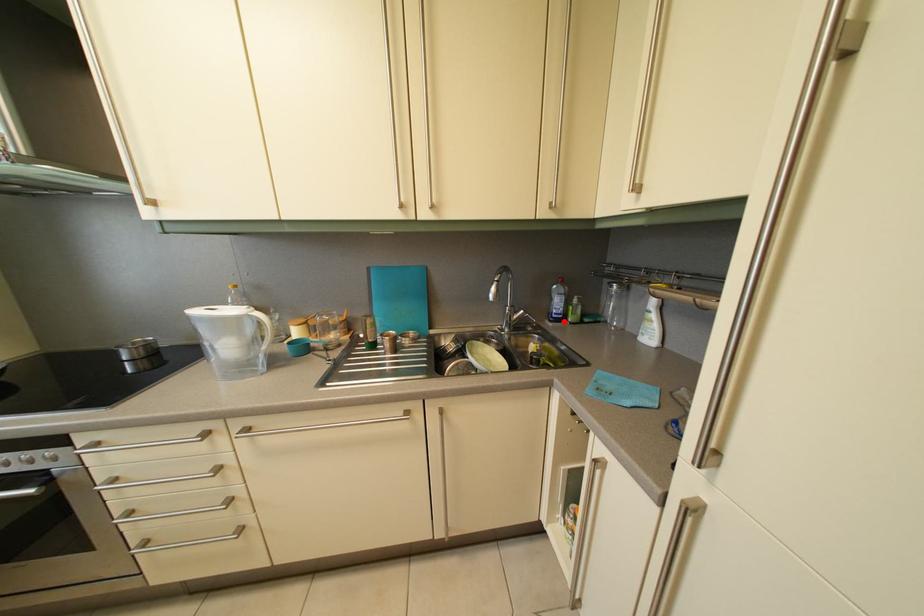
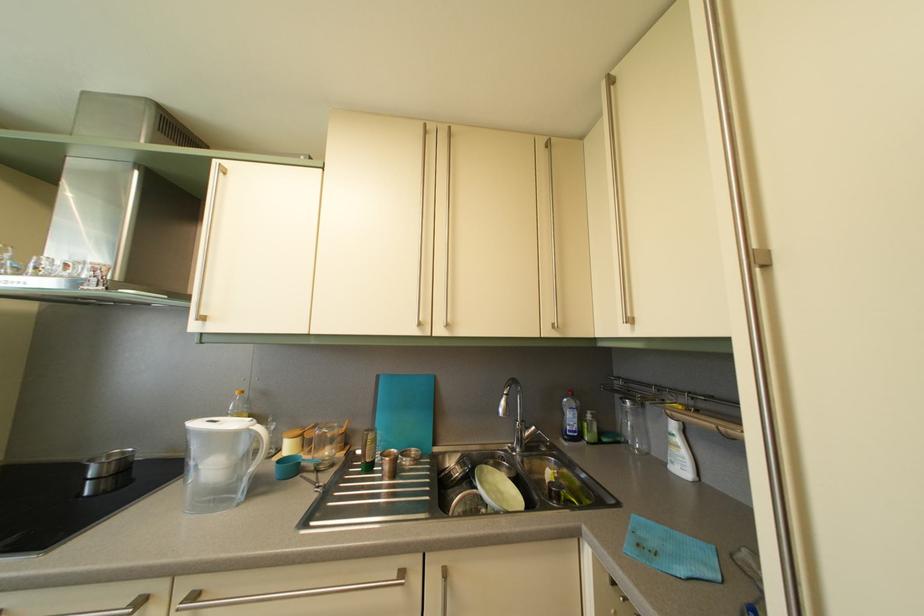
In the second image, find the point that corresponds to the highlighted location in the first image.

(578, 439)